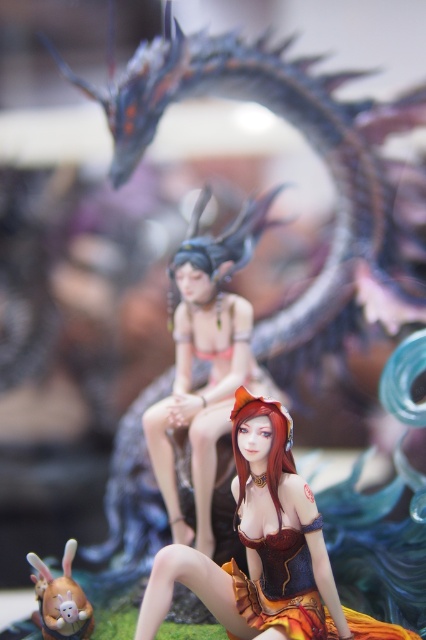
You are a collector who wants to display both the shiny orange fabric dress at center and the matte brown plush rabbit at lower left together in a showcase. Which object should you place first to ensure they are proportionally balanced?

Since the shiny orange fabric dress at center is larger in size than the matte brown plush rabbit at lower left, you should place the shiny orange fabric dress at center first to create a balanced display by positioning the smaller object around it.

You are a collector who wants to place a new 3.5 inch tall statue between the satin gold dress at center and the matte brown plush rabbit at lower left. Is there enough space for the statue to fit without overlapping either object?

The distance between the satin gold dress at center and the matte brown plush rabbit at lower left is 7.44 inches. Since the statue is 3.5 inches tall, there is sufficient space to place it between them without overlapping either object.

You are an artist planning to paint this scene. You need to decide which object to paint first based on their size. Which object should you start with, the shiny orange fabric dress at center or the matte brown plush rabbit at lower left?

The shiny orange fabric dress at center is taller than the matte brown plush rabbit at lower left, so you should start with the shiny orange fabric dress at center because it is larger in size.